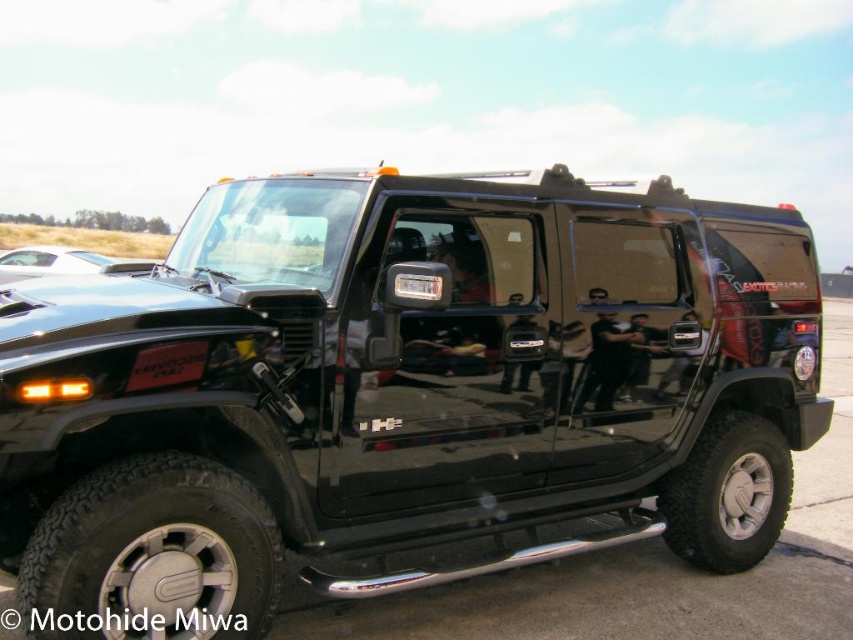
You are a photographer trying to capture the glossy black suv at center and the black matte license plate at center in the same frame. Can you see both objects clearly at the same time?

The glossy black suv at center is in front of the black matte license plate at center, so the license plate might be obscured by the SUV in the photo.

You are a photographer trying to capture the glossy black car at upper left and the other car in the background. According to the coordinates provided, which car is positioned higher on the image?

The glossy black car at upper left is positioned higher on the image because it is located at point (62, 262), which has a lower y coordinate than the other car in the background.

Based on the photo, you are standing at the origin point in the image. The glossy black suv at center is located at point 0.613, 0.471. If you want to walk towards the suv, which direction should you head?

The glossy black suv at center is located at point [401,392], so you should head towards the center of the image where the SUV is positioned.